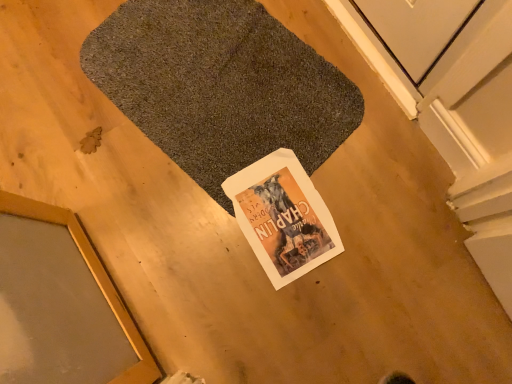
Locate an element on the screen. The height and width of the screenshot is (384, 512). free space behind white paper magazine at center is located at coordinates (262, 122).